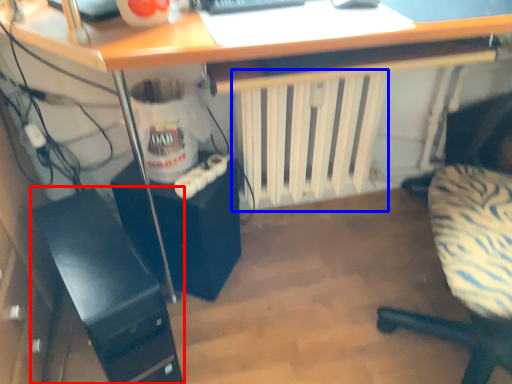
Question: Among these objects, which one is nearest to the camera, computer tower (highlighted by a red box) or radiator (highlighted by a blue box)?

Choices:
 (A) computer tower
 (B) radiator

Answer: (A)